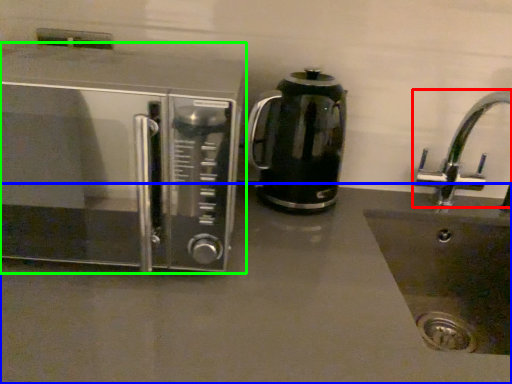
Question: Estimate the real-world distances between objects in this image. Which object is closer to tap (highlighted by a red box), counter top (highlighted by a blue box) or microwave oven (highlighted by a green box)?

Choices:
 (A) counter top
 (B) microwave oven

Answer: (A)